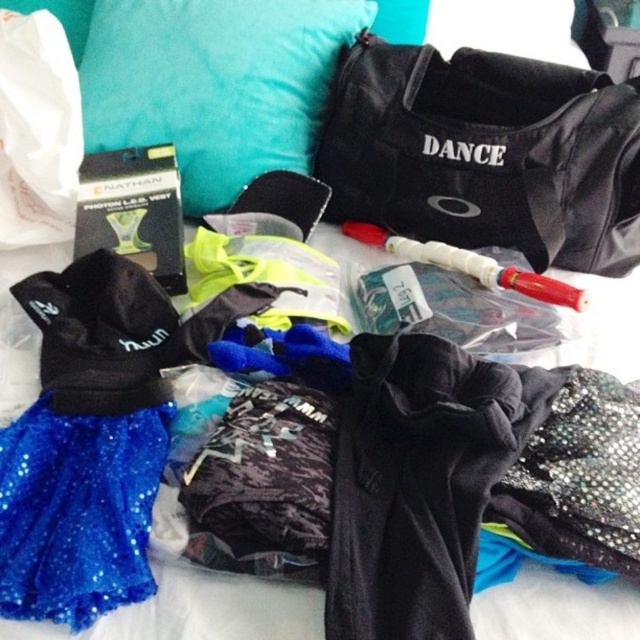
You are a dancer preparing for a performance and see the teal fabric pillow at upper left and the sparkly blue skirt at lower left on your bed. Which item is positioned higher up on the bed?

The teal fabric pillow at upper left is positioned higher up on the bed than the sparkly blue skirt at lower left.

You are a dancer preparing for a performance and need to place your black fabric duffel at upper right and teal fabric pillow at upper left on the bed. Based on their sizes, which item should you place first to ensure both fit properly?

The black fabric duffel at upper right might be wider than the teal fabric pillow at upper left, so you should place the wider item first to ensure proper placement.

What is the location of the point at coordinates (484,154) in the image?

The point at coordinates (484,154) corresponds to the black fabric duffel at upper right.